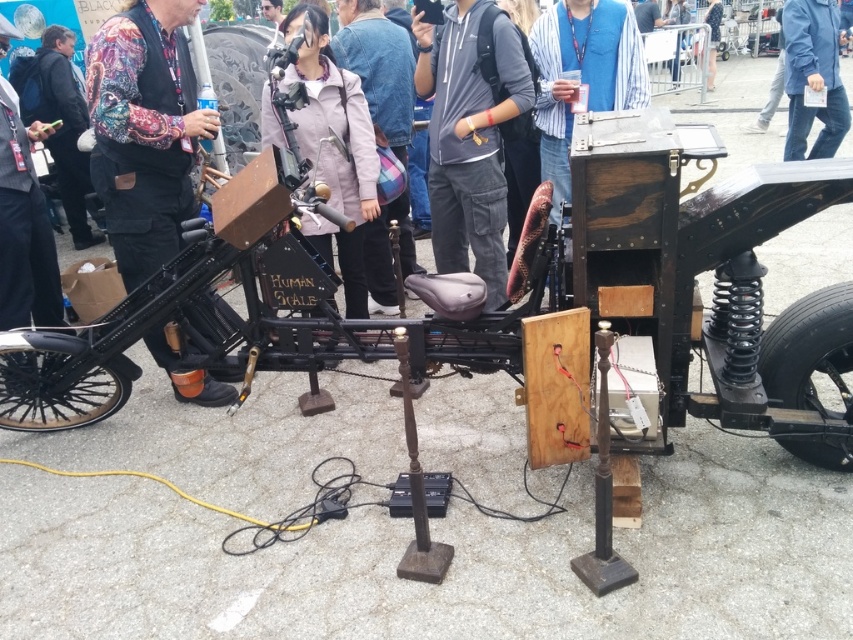
Question: Can you confirm if light purple fabric jacket at center is positioned to the right of blue jeans at lower right?

Choices:
 (A) no
 (B) yes

Answer: (A)

Question: Among these points, which one is nearest to the camera?

Choices:
 (A) (721, 17)
 (B) (813, 84)
 (C) (381, 211)
 (D) (450, 67)

Answer: (D)

Question: Which object is farther from the camera taking this photo?

Choices:
 (A) light purple fabric jacket at center
 (B) patterned fabric shirt at center
 (C) gray cotton hoodie at center
 (D) blue jeans at lower right

Answer: (D)

Question: Among these objects, which one is nearest to the camera?

Choices:
 (A) blue denim jacket at upper center
 (B) gray cotton hoodie at center
 (C) light purple fabric jacket at center

Answer: (B)

Question: Does blue jeans at lower right appear under black leather jacket at left?

Choices:
 (A) no
 (B) yes

Answer: (A)

Question: Is black leather jacket at left bigger than blue denim jacket at upper center?

Choices:
 (A) no
 (B) yes

Answer: (B)